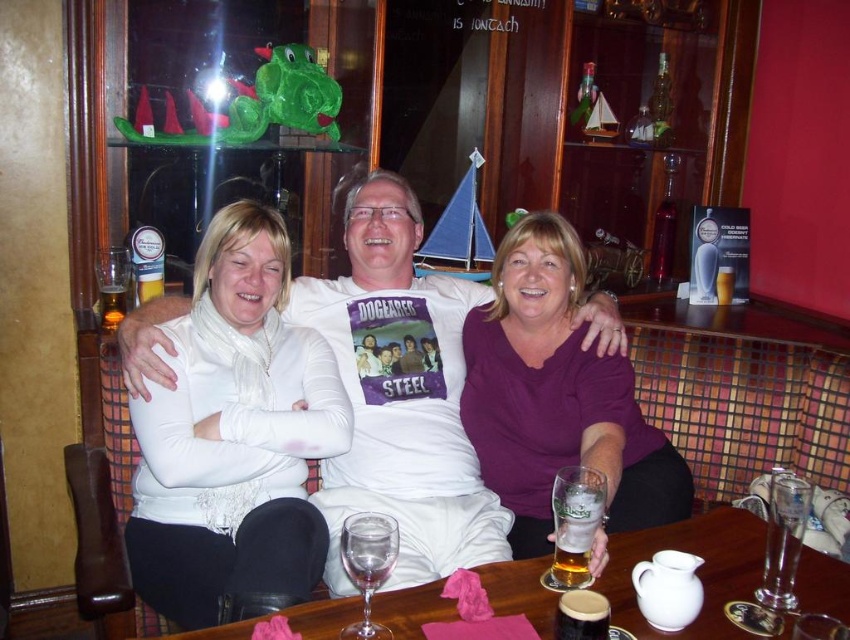
You are a bartender who needs to reach the translucent glass wine at center to refill it. There is a purple matte shirt at center in your way. Can you easily access the wine glass without moving the shirt?

The translucent glass wine at center is behind the purple matte shirt at center, so you cannot easily access the wine glass without moving the shirt.

You are standing at the entrance of the bar and see two points in the image. Which point is closer to you, point (831, 604) or point (562, 586)?

Point (831, 604) is in front of point (562, 586), so it is closer to you.

You are a bartender preparing to place a new drink order on the table. The order includes a purple matte shirt at center and a translucent glass wine at center. Based on the current arrangement, where should you place the translucent glass wine to ensure it aligns with the existing setup?

The purple matte shirt at center is positioned on the right side of the translucent glass wine at center, so the translucent glass wine at center should be placed to the left of the purple matte shirt at center to maintain the existing arrangement.